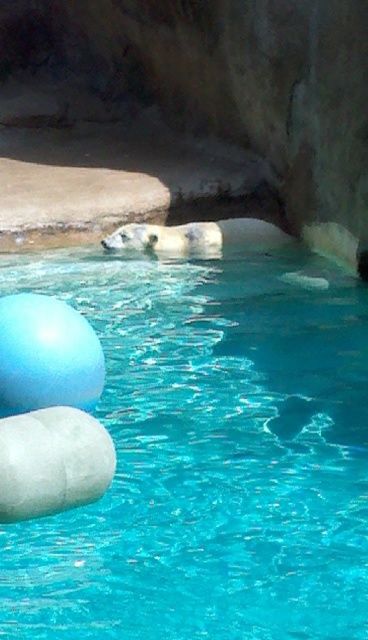
You are a zookeeper observing the polar bear in its enclosure. You notice the transparent blue water at upper center. Where exactly is this water located in relation to the polar bear?

The transparent blue water at upper center is located at point coordinates approximately 0.711 on the x axis and 0.565 on the y axis.

You are a zookeeper observing the polar bear enclosure. You notice the transparent blue water at upper center and the white fur polar bear at center. Which object takes up more space in the enclosure?

The white fur polar bear at center occupies more space than the transparent blue water at upper center.

You are a zookeeper who needs to ensure the safety of visitors. The enclosure has a safety guideline stating that the distance between the transparent blue water at upper center and the white fur polar bear at center must be at least 5 meters. Based on the scene, is the current distance compliant with this guideline?

The transparent blue water at upper center and the white fur polar bear at center are 6.25 meters apart, which exceeds the required 5 meters, so the distance is compliant with the safety guideline.